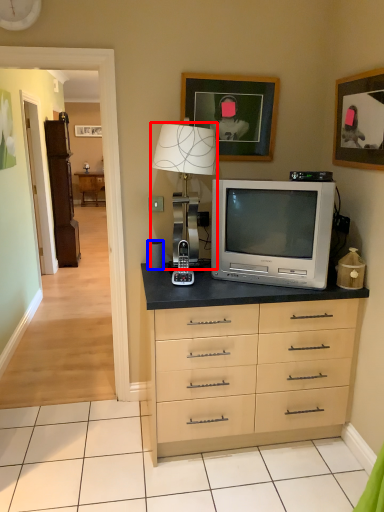
Question: Which object is further to the camera taking this photo, table lamp (highlighted by a red box) or speaker (highlighted by a blue box)?

Choices:
 (A) table lamp
 (B) speaker

Answer: (B)